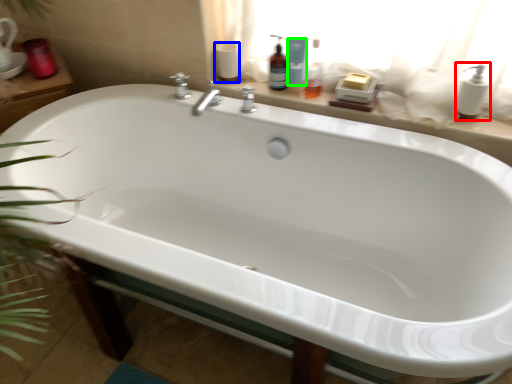
Question: Which is farther away from soap dispenser (highlighted by a red box)? toilet paper (highlighted by a blue box) or cleaning product (highlighted by a green box)?

Choices:
 (A) toilet paper
 (B) cleaning product

Answer: (A)